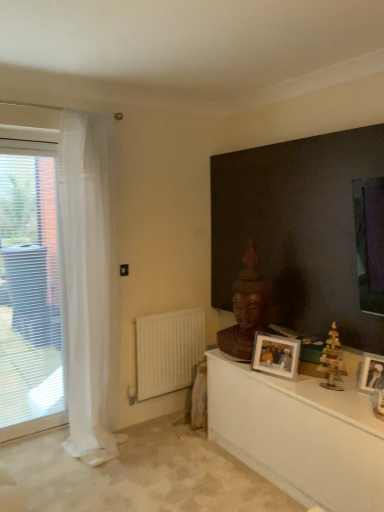
Question: Would you say wooden toy at right is inside or outside white glossy table at lower right?

Choices:
 (A) outside
 (B) inside

Answer: (A)

Question: Is wooden toy at right taller or shorter than white glossy table at lower right?

Choices:
 (A) short
 (B) tall

Answer: (A)

Question: Which object is the farthest from the white sheer curtain at left?

Choices:
 (A) brown wooden statue at center
 (B) transparent glass window at left
 (C) metallic silver photo frame at right, the 2th picture frame positioned from the back
 (D) dark wood buddha head at center
 (E) white glossy table at lower right

Answer: (C)

Question: Which object is positioned farthest from the wooden photo frame at center, the first picture frame viewed from the left?

Choices:
 (A) white glossy table at lower right
 (B) dark wood buddha head at center
 (C) metallic silver photo frame at right, placed as the first picture frame when sorted from right to left
 (D) brown wooden statue at center
 (E) transparent glass window at left

Answer: (E)